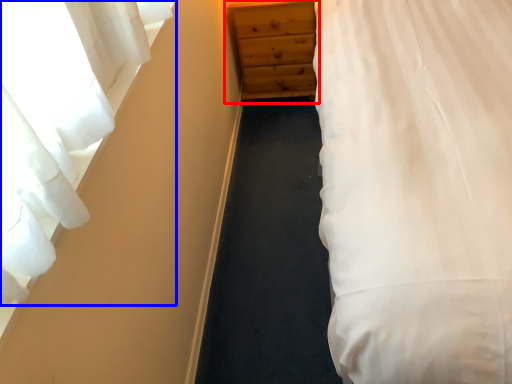
Question: Which object appears farthest to the camera in this image, chest of drawers (highlighted by a red box) or curtain (highlighted by a blue box)?

Choices:
 (A) chest of drawers
 (B) curtain

Answer: (A)